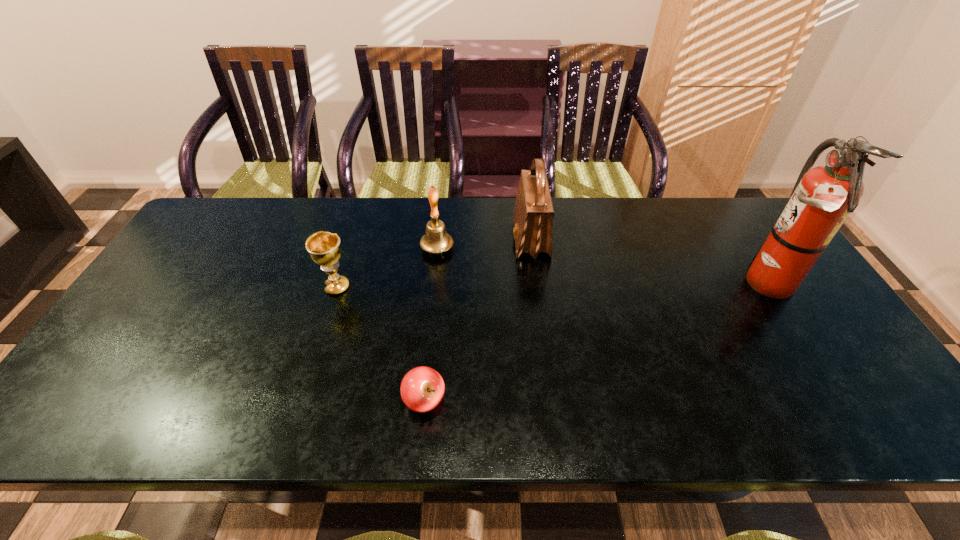
I want to click on free point between the shoulder bag and the nearest object, so click(478, 320).

Identify the location of free spot between the tallest object and the second shortest object. The width and height of the screenshot is (960, 540). (550, 285).

The height and width of the screenshot is (540, 960). In order to click on vacant space that's between the chalice and the bell in this screenshot , I will do `click(387, 268)`.

Identify the location of empty space between the bell and the shortest object. The height and width of the screenshot is (540, 960). (431, 325).

The width and height of the screenshot is (960, 540). Find the location of `unoccupied area between the nearest object and the shoulder bag`. unoccupied area between the nearest object and the shoulder bag is located at coordinates (478, 320).

What are the coordinates of `vacant region between the chalice and the apple` in the screenshot? It's located at (381, 344).

Find the location of a particular element. The height and width of the screenshot is (540, 960). free space between the fire extinguisher and the bell is located at coordinates (600, 266).

Where is `vacant area that lies between the fourth shortest object and the bell`? The height and width of the screenshot is (540, 960). vacant area that lies between the fourth shortest object and the bell is located at coordinates (484, 244).

Locate which object ranks in proximity to the fourth shortest object. Please provide its 2D coordinates. Your answer should be formatted as a tuple, i.e. [(x, y)], where the tuple contains the x and y coordinates of a point satisfying the conditions above.

[(436, 240)]

The width and height of the screenshot is (960, 540). I want to click on the closest object to the leftmost object, so click(x=436, y=240).